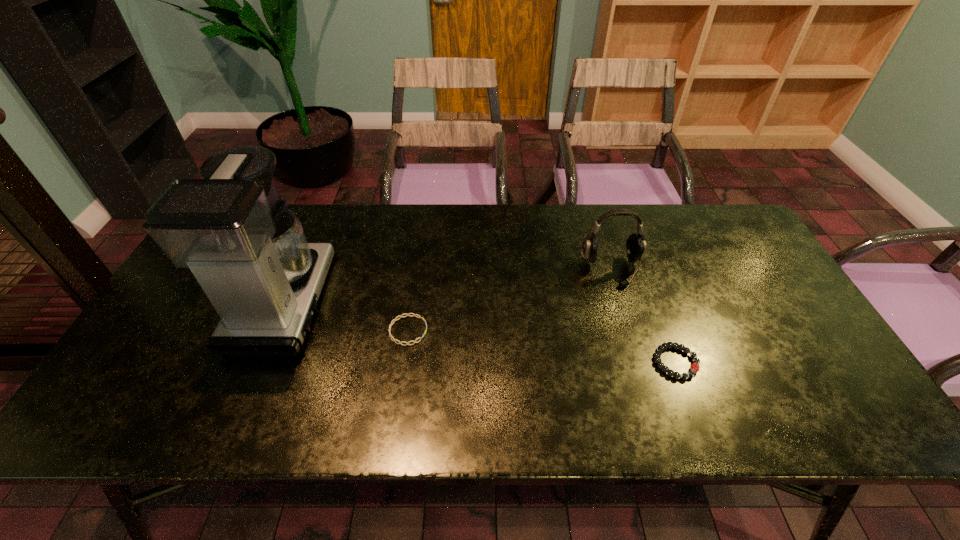
Locate an element on the screen. The height and width of the screenshot is (540, 960). vacant space located 0.370m on the surface of the left bracelet showing star-shaped elements is located at coordinates (571, 330).

Find the location of a particular element. Image resolution: width=960 pixels, height=540 pixels. vacant point at the far edge is located at coordinates (365, 208).

Image resolution: width=960 pixels, height=540 pixels. In the image, there is a desktop. Identify the location of vacant space at the near edge. (660, 406).

In the image, there is a desktop. Identify the location of vacant space at the left edge. The width and height of the screenshot is (960, 540). (180, 312).

You are a GUI agent. You are given a task and a screenshot of the screen. Output one action in this format:
    pyautogui.click(x=<x>, y=<y>)
    Task: Click on the free spot at the right edge of the desktop
    This screenshot has width=960, height=540.
    Given the screenshot: What is the action you would take?
    pyautogui.click(x=740, y=292)

Where is `blank region between the tallest object and the left bracelet`? blank region between the tallest object and the left bracelet is located at coordinates coord(347,316).

The width and height of the screenshot is (960, 540). In order to click on empty space that is in between the headset and the second object from left to right in this screenshot , I will do `click(510, 300)`.

Where is `vacant space that's between the taller bracelet and the shorter bracelet`? vacant space that's between the taller bracelet and the shorter bracelet is located at coordinates (542, 346).

Identify the location of vacant area that lies between the tallest object and the headset. (448, 286).

Identify the location of vacant space that's between the shorter bracelet and the headset. The width and height of the screenshot is (960, 540). (510, 300).